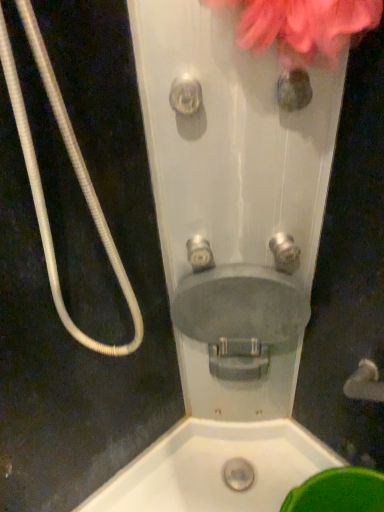
Measure the distance between point (190, 244) and camera.

They are 32.40 inches apart.

In order to face white corrugated hose at left, should I rotate leftwards or rightwards?

It's best to rotate left around 12.132 degrees.

Where is `white corrugated hose at left`? This screenshot has width=384, height=512. white corrugated hose at left is located at coordinates (76, 175).

Describe the element at coordinates (285, 253) in the screenshot. This screenshot has width=384, height=512. I see `brushed metal faucet at center, the 2th plumbing fixture from the left` at that location.

Where is `brushed metal faucet at center, which ranks as the 1th plumbing fixture in right-to-left order`? brushed metal faucet at center, which ranks as the 1th plumbing fixture in right-to-left order is located at coordinates (285, 253).

What is the approximate height of clear plastic showerhead at center?

2.66 inches.

Find the location of a particular element. matte gray sink at center is located at coordinates (241, 300).

The image size is (384, 512). In order to click on satin silver faucet at center, which is the first plumbing fixture in left-to-right order in this screenshot , I will do `click(199, 254)`.

Which object is wider, pink fluffy flower at upper right or satin silver faucet at center, marked as the second plumbing fixture in a right-to-left arrangement?

pink fluffy flower at upper right.

From the image's perspective, which is above, pink fluffy flower at upper right or satin silver faucet at center, which is the first plumbing fixture in left-to-right order?

pink fluffy flower at upper right.

Is pink fluffy flower at upper right inside or outside of satin silver faucet at center, which is the first plumbing fixture in left-to-right order?

pink fluffy flower at upper right is located beyond the bounds of satin silver faucet at center, which is the first plumbing fixture in left-to-right order.

Which object is positioned more to the left, pink fluffy flower at upper right or satin silver faucet at center, marked as the second plumbing fixture in a right-to-left arrangement?

From the viewer's perspective, satin silver faucet at center, marked as the second plumbing fixture in a right-to-left arrangement, appears more on the left side.

Is white corrugated hose at left inside the boundaries of satin silver faucet at center, marked as the second plumbing fixture in a right-to-left arrangement, or outside?

white corrugated hose at left is outside satin silver faucet at center, marked as the second plumbing fixture in a right-to-left arrangement.

Where is `garden hose positioned vertically above the satin silver faucet at center, which is the first plumbing fixture in left-to-right order (from a real-world perspective)`? The image size is (384, 512). garden hose positioned vertically above the satin silver faucet at center, which is the first plumbing fixture in left-to-right order (from a real-world perspective) is located at coordinates (76, 175).

Can you confirm if white corrugated hose at left is thinner than satin silver faucet at center, marked as the second plumbing fixture in a right-to-left arrangement?

In fact, white corrugated hose at left might be wider than satin silver faucet at center, marked as the second plumbing fixture in a right-to-left arrangement.

Is white corrugated hose at left far away from satin silver faucet at center, marked as the second plumbing fixture in a right-to-left arrangement?

That's not correct — white corrugated hose at left is a little close to satin silver faucet at center, marked as the second plumbing fixture in a right-to-left arrangement.

From a real-world perspective, is satin silver faucet at center, marked as the second plumbing fixture in a right-to-left arrangement, below brushed metal faucet at center, which ranks as the 1th plumbing fixture in right-to-left order?

Yes.

In the scene shown: Could you tell me if satin silver faucet at center, which is the first plumbing fixture in left-to-right order, is facing brushed metal faucet at center, the 2th plumbing fixture from the left?

No, satin silver faucet at center, which is the first plumbing fixture in left-to-right order, is not oriented towards brushed metal faucet at center, the 2th plumbing fixture from the left.

Can you confirm if satin silver faucet at center, which is the first plumbing fixture in left-to-right order, is positioned to the left of brushed metal faucet at center, which ranks as the 1th plumbing fixture in right-to-left order?

Yes.

Based on the photo, how different are the orientations of satin silver faucet at center, marked as the second plumbing fixture in a right-to-left arrangement, and brushed metal faucet at center, the 2th plumbing fixture from the left, in degrees?

The facing directions of satin silver faucet at center, marked as the second plumbing fixture in a right-to-left arrangement, and brushed metal faucet at center, the 2th plumbing fixture from the left, are 0.00229 degrees apart.

You are a GUI agent. You are given a task and a screenshot of the screen. Output one action in this format:
    pyautogui.click(x=<x>, y=<y>)
    Task: Click on the sink that appears below the clear plastic showerhead at center (from a real-world perspective)
    
    Given the screenshot: What is the action you would take?
    pyautogui.click(x=241, y=300)

Is matte gray sink at center placed right next to clear plastic showerhead at center?

No, matte gray sink at center is not beside clear plastic showerhead at center.

Choose the correct answer: Is matte gray sink at center inside clear plastic showerhead at center or outside it?

matte gray sink at center cannot be found inside clear plastic showerhead at center.

How many degrees apart are the facing directions of matte gray sink at center and clear plastic showerhead at center?

The angular difference between matte gray sink at center and clear plastic showerhead at center is 0.0028 degrees.

Choose the correct answer: Is matte gray sink at center inside white corrugated hose at left or outside it?

The correct answer is: outside.

Considering the sizes of objects matte gray sink at center and white corrugated hose at left in the image provided, who is bigger, matte gray sink at center or white corrugated hose at left?

Bigger between the two is white corrugated hose at left.

Is matte gray sink at center aimed at white corrugated hose at left?

No, matte gray sink at center is not facing towards white corrugated hose at left.

Is white corrugated hose at left with clear plastic showerhead at center?

No.

From the image's perspective, is white corrugated hose at left over clear plastic showerhead at center?

Incorrect, from the image's perspective, white corrugated hose at left is lower than clear plastic showerhead at center.

Is point (39, 222) farther from camera compared to point (185, 100)?

No, it is not.

In the scene shown: Considering the relative positions of clear plastic showerhead at center and brushed metal faucet at center, which ranks as the 1th plumbing fixture in right-to-left order, in the image provided, is clear plastic showerhead at center to the right of brushed metal faucet at center, which ranks as the 1th plumbing fixture in right-to-left order, from the viewer's perspective?

No, clear plastic showerhead at center is not to the right of brushed metal faucet at center, which ranks as the 1th plumbing fixture in right-to-left order.

From a real-world perspective, is clear plastic showerhead at center above or below brushed metal faucet at center, the 2th plumbing fixture from the left?

Clearly, from a real-world perspective, clear plastic showerhead at center is above brushed metal faucet at center, the 2th plumbing fixture from the left.

Considering the points (184, 76) and (298, 255), which point is behind, point (184, 76) or point (298, 255)?

Point (298, 255)

There is a clear plastic showerhead at center. Where is `the 1st plumbing fixture below it (from the image's perspective)`? This screenshot has height=512, width=384. the 1st plumbing fixture below it (from the image's perspective) is located at coordinates (285, 253).

Locate an element on the screen. flower above the satin silver faucet at center, marked as the second plumbing fixture in a right-to-left arrangement (from the image's perspective) is located at coordinates (302, 26).

Which plumbing fixture is the 1st one when counting from the right side of the white corrugated hose at left? Please provide its 2D coordinates.

[(199, 254)]

Estimate the real-world distances between objects in this image. Which object is closer to clear plastic showerhead at center, brushed metal faucet at center, which ranks as the 1th plumbing fixture in right-to-left order, or white corrugated hose at left?

white corrugated hose at left is closer to clear plastic showerhead at center.

Based on their spatial positions, is clear plastic showerhead at center or pink fluffy flower at upper right closer to white corrugated hose at left?

clear plastic showerhead at center lies closer to white corrugated hose at left than the other object.

When comparing their distances from clear plastic showerhead at center, does pink fluffy flower at upper right or brushed metal faucet at center, the 2th plumbing fixture from the left, seem further?

brushed metal faucet at center, the 2th plumbing fixture from the left, is positioned further to the anchor clear plastic showerhead at center.

Looking at the image, which one is located further to white corrugated hose at left, satin silver faucet at center, which is the first plumbing fixture in left-to-right order, or brushed metal faucet at center, which ranks as the 1th plumbing fixture in right-to-left order?

brushed metal faucet at center, which ranks as the 1th plumbing fixture in right-to-left order, is positioned further to the anchor white corrugated hose at left.

When comparing their distances from matte gray sink at center, does satin silver faucet at center, marked as the second plumbing fixture in a right-to-left arrangement, or clear plastic showerhead at center seem closer?

satin silver faucet at center, marked as the second plumbing fixture in a right-to-left arrangement, lies closer to matte gray sink at center than the other object.

From the image, which object appears to be farther from matte gray sink at center, satin silver faucet at center, which is the first plumbing fixture in left-to-right order, or brushed metal faucet at center, the 2th plumbing fixture from the left?

Among the two, brushed metal faucet at center, the 2th plumbing fixture from the left, is located further to matte gray sink at center.

Considering their positions, is pink fluffy flower at upper right positioned closer to satin silver faucet at center, marked as the second plumbing fixture in a right-to-left arrangement, than matte gray sink at center?

matte gray sink at center is closer to satin silver faucet at center, marked as the second plumbing fixture in a right-to-left arrangement.

Based on the photo, considering their positions, is white corrugated hose at left positioned further to clear plastic showerhead at center than pink fluffy flower at upper right?

white corrugated hose at left is positioned further to the anchor clear plastic showerhead at center.

The height and width of the screenshot is (512, 384). I want to click on sink between white corrugated hose at left and satin silver faucet at center, which is the first plumbing fixture in left-to-right order, in the front-back direction, so click(241, 300).

You are a GUI agent. You are given a task and a screenshot of the screen. Output one action in this format:
    pyautogui.click(x=<x>, y=<y>)
    Task: Click on the plumbing fixture between clear plastic showerhead at center and satin silver faucet at center, which is the first plumbing fixture in left-to-right order, vertically
    The width and height of the screenshot is (384, 512).
    Given the screenshot: What is the action you would take?
    pyautogui.click(x=285, y=253)

At what (x,y) coordinates should I click in order to perform the action: click on shower between white corrugated hose at left and matte gray sink at center from front to back. Please return your answer as a coordinate pair (x, y). Image resolution: width=384 pixels, height=512 pixels. Looking at the image, I should click on (185, 95).

Identify the location of flower between white corrugated hose at left and satin silver faucet at center, marked as the second plumbing fixture in a right-to-left arrangement, from front to back. (302, 26).